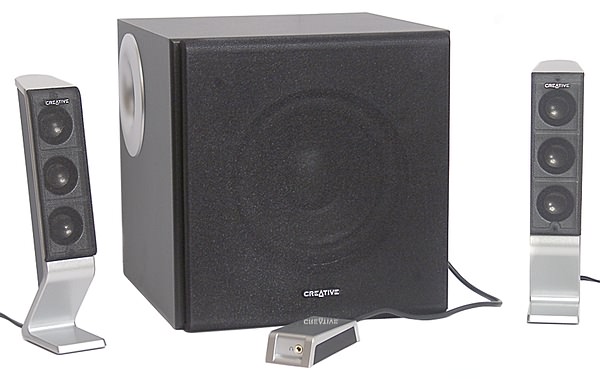
Locate an element on the screen. This screenshot has width=600, height=379. 1 big speaker in the middle is located at coordinates pyautogui.click(x=318, y=177).